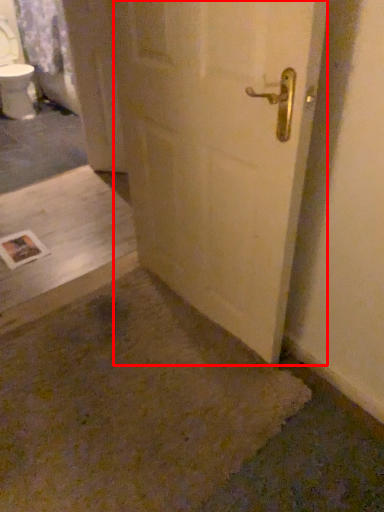
Question: Where is door (annotated by the red box) located in relation to concrete in the image?

Choices:
 (A) right
 (B) left

Answer: (A)